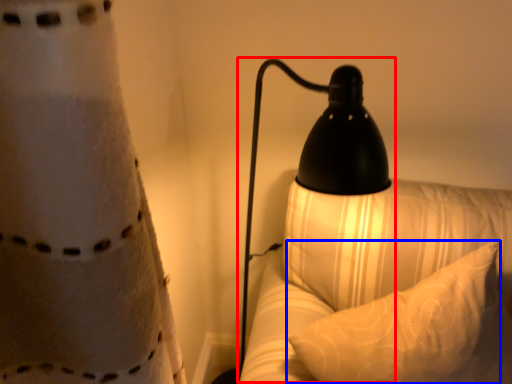
Question: Which point is further to the camera, lamp (highlighted by a red box) or pillow (highlighted by a blue box)?

Choices:
 (A) lamp
 (B) pillow

Answer: (B)